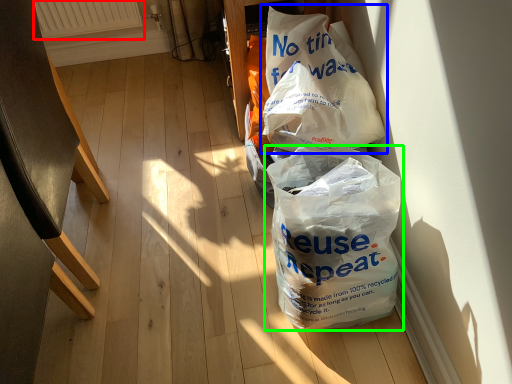
Question: Estimate the real-world distances between objects in this image. Which object is closer to radiator (highlighted by a red box), plastic bag (highlighted by a blue box) or plastic bag (highlighted by a green box)?

Choices:
 (A) plastic bag
 (B) plastic bag

Answer: (A)